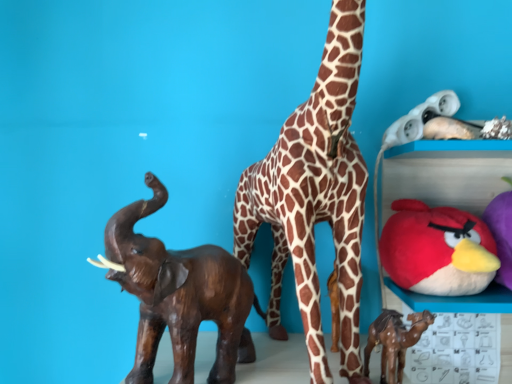
Question: Does point (320, 327) appear closer or farther from the camera than point (486, 225)?

Choices:
 (A) farther
 (B) closer

Answer: (A)

Question: In terms of width, does brown spotted fabric giraffe at center look wider or thinner when compared to soft plush bird at right, the 1th toy when ordered from right to left?

Choices:
 (A) thin
 (B) wide

Answer: (B)

Question: Which object is positioned farthest from the brown spotted fabric giraffe at center?

Choices:
 (A) brown wooden elephant at left, placed as the first toy when sorted from left to right
 (B) red plush toy at upper right, marked as the 3th toy in a left-to-right arrangement
 (C) brown glossy camel at lower right, the 3th toy positioned from the right
 (D) soft plush bird at right, the 1th toy when ordered from right to left

Answer: (D)

Question: Considering the real-world distances, which object is farthest from the soft plush bird at right, the 1th toy when ordered from right to left?

Choices:
 (A) brown glossy camel at lower right, the 3th toy positioned from the right
 (B) red plush toy at upper right, marked as the 3th toy in a left-to-right arrangement
 (C) brown spotted fabric giraffe at center
 (D) brown wooden elephant at left, acting as the fourth toy starting from the right

Answer: (D)